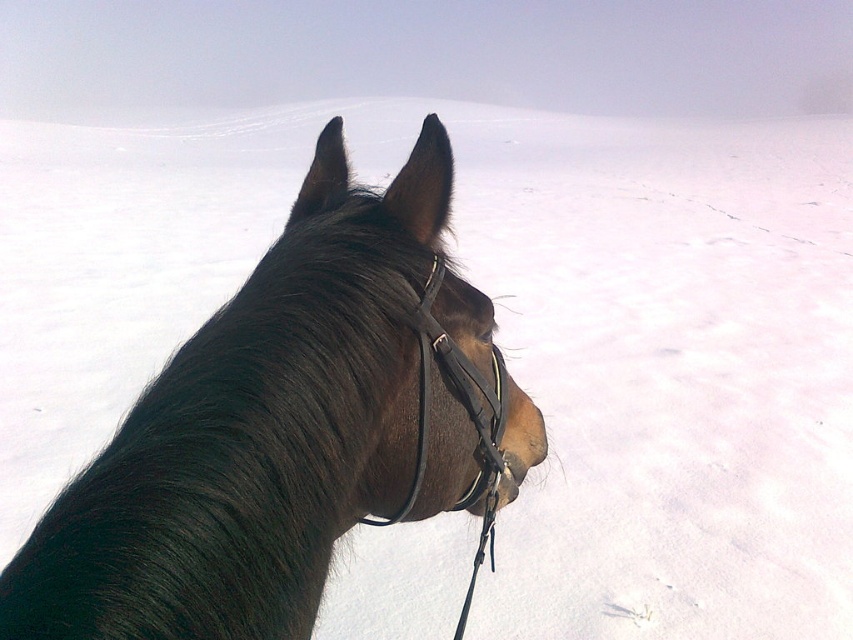
Question: Considering the relative positions of shiny brown horse at center and black leather bridle at center in the image provided, where is shiny brown horse at center located with respect to black leather bridle at center?

Choices:
 (A) left
 (B) right

Answer: (A)

Question: Which point is closer to the camera taking this photo?

Choices:
 (A) (437, 369)
 (B) (241, 438)

Answer: (B)

Question: Considering the relative positions of shiny brown horse at center and black leather bridle at center in the image provided, where is shiny brown horse at center located with respect to black leather bridle at center?

Choices:
 (A) right
 (B) left

Answer: (B)

Question: Is shiny brown horse at center smaller than black leather bridle at center?

Choices:
 (A) no
 (B) yes

Answer: (A)